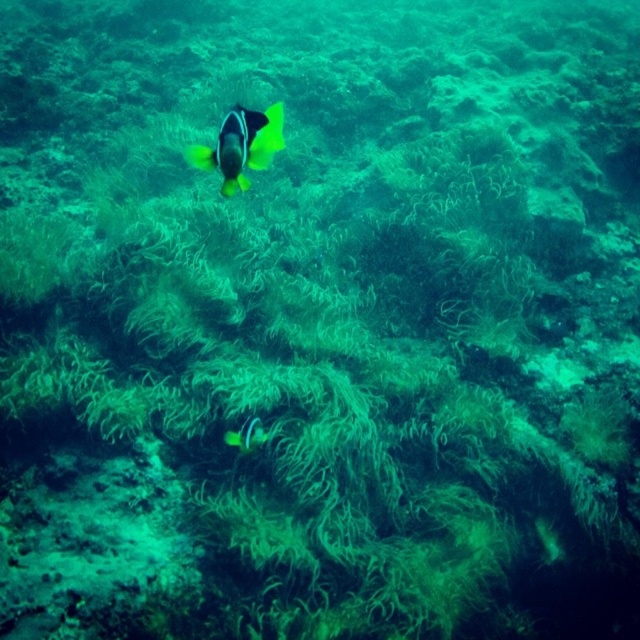
You are a marine biologist observing an underwater scene. You need to locate the yellow matte fish at center for a study. According to the coordinates provided, where exactly is the fish positioned in the image?

The yellow matte fish at center is positioned at the 2D coordinates point (241, 145) in the image.

You are a marine biologist observing an underwater scene. You notice two fish at the center of the image. One is labeled as the yellow matte fish at center and the other as the bright yellow and black fish at center. Based on their sizes, which fish would cast a larger shadow on the seabed below?

The yellow matte fish at center is much taller than the bright yellow and black fish at center, so it would cast a larger shadow on the seabed below.